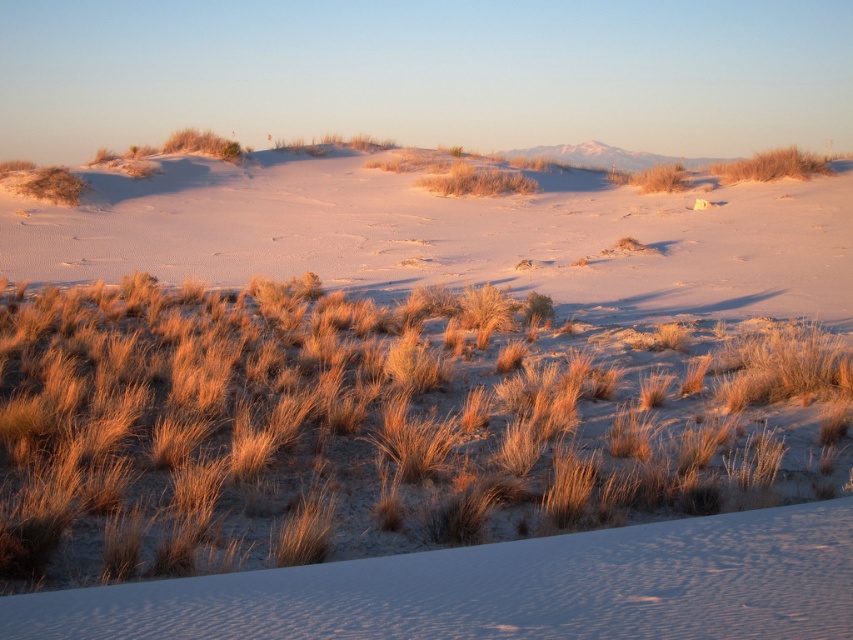
You are a hiker trying to navigate through the desert. You notice two grass patches, the dry grass at center and the golden grass at upper center. Which grass patch is smaller in size?

The dry grass at center has a smaller size compared to the golden grass at upper center, so the dry grass at center is the smaller one.

Based on the photo, you are standing in the desert scene shown. There is a point marked at coordinates (376, 424). What is located at this point?

The point at coordinates (376, 424) is where the dry grass at center is located.

You are standing in the desert scene and want to walk from the point at coordinates point (302,516) to the point at coordinates point (1,232). According to the image, will you have to walk towards the foreground or the background?

You will have to walk towards the background because point (302,516) is in front of point (1,232), meaning the destination is further away from your current position.